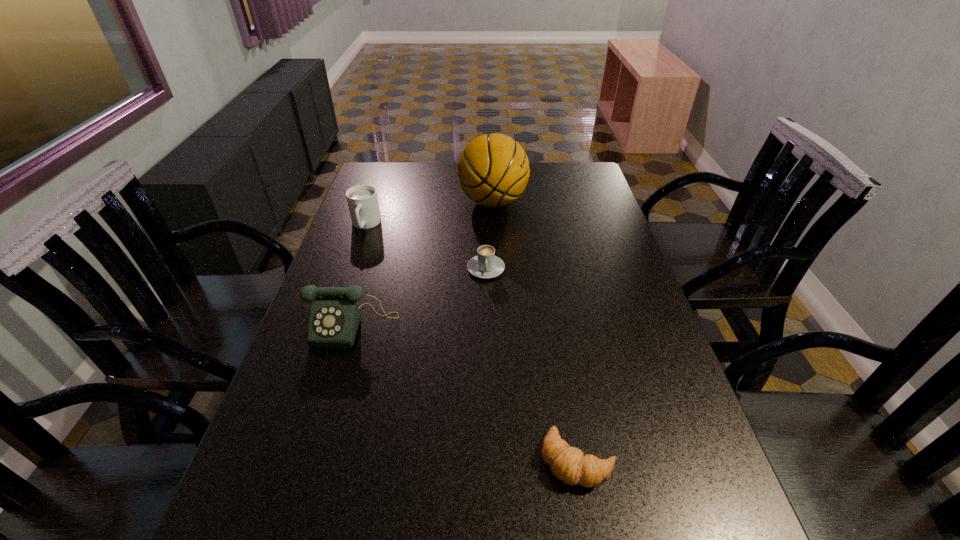
The height and width of the screenshot is (540, 960). I want to click on vacant space at the right edge of the desktop, so click(x=647, y=312).

Where is `vacant area that lies between the taller cappuccino and the shorter cappuccino`? vacant area that lies between the taller cappuccino and the shorter cappuccino is located at coordinates (425, 247).

Image resolution: width=960 pixels, height=540 pixels. I want to click on free space between the tallest object and the taller cappuccino, so click(429, 214).

Identify the location of empty space that is in between the shorter cappuccino and the nearest object. This screenshot has width=960, height=540. tap(532, 364).

The width and height of the screenshot is (960, 540). I want to click on free space between the tallest object and the telephone, so click(423, 264).

I want to click on free space between the telephone and the right cappuccino, so click(420, 297).

The height and width of the screenshot is (540, 960). Find the location of `empty space between the telephone and the basketball`. empty space between the telephone and the basketball is located at coordinates (423, 264).

Where is `blank region between the nearer cappuccino and the basketball`? This screenshot has width=960, height=540. blank region between the nearer cappuccino and the basketball is located at coordinates (490, 235).

I want to click on unoccupied position between the telephone and the nearest object, so click(466, 393).

Identify the location of vacant region between the left cappuccino and the nearest object. (471, 343).